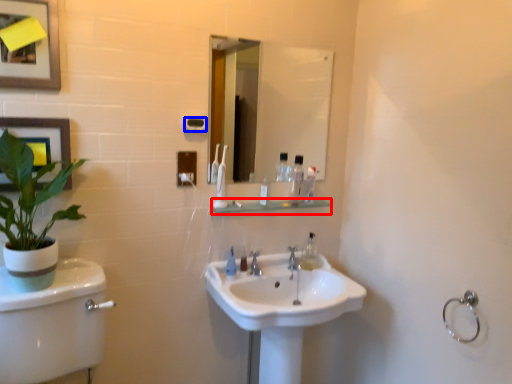
Question: Which object is closer to the camera taking this photo, balustrade (highlighted by a red box) or towel bar (highlighted by a blue box)?

Choices:
 (A) balustrade
 (B) towel bar

Answer: (B)